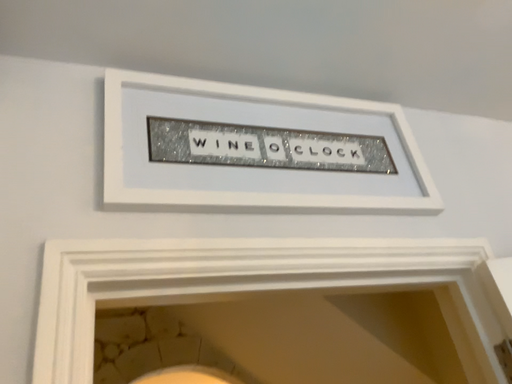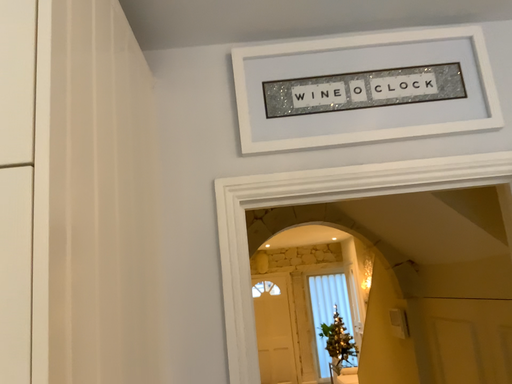
Question: How did the camera likely rotate when shooting the video?

Choices:
 (A) rotated right
 (B) rotated left

Answer: (B)